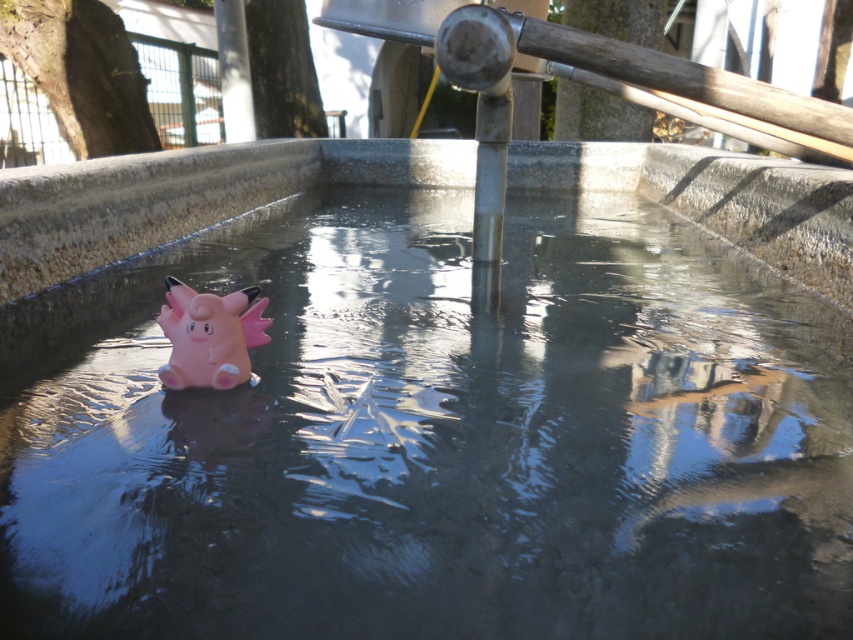
Question: Can you confirm if transparent water at center is positioned to the right of pink rubber toy at center?

Choices:
 (A) no
 (B) yes

Answer: (B)

Question: Does transparent water at center appear under pink rubber toy at center?

Choices:
 (A) yes
 (B) no

Answer: (B)

Question: Observing the image, what is the correct spatial positioning of transparent water at center in reference to pink rubber toy at center?

Choices:
 (A) left
 (B) right

Answer: (B)

Question: Which of the following is the farthest from the observer?

Choices:
 (A) (190, 342)
 (B) (339, 448)

Answer: (A)